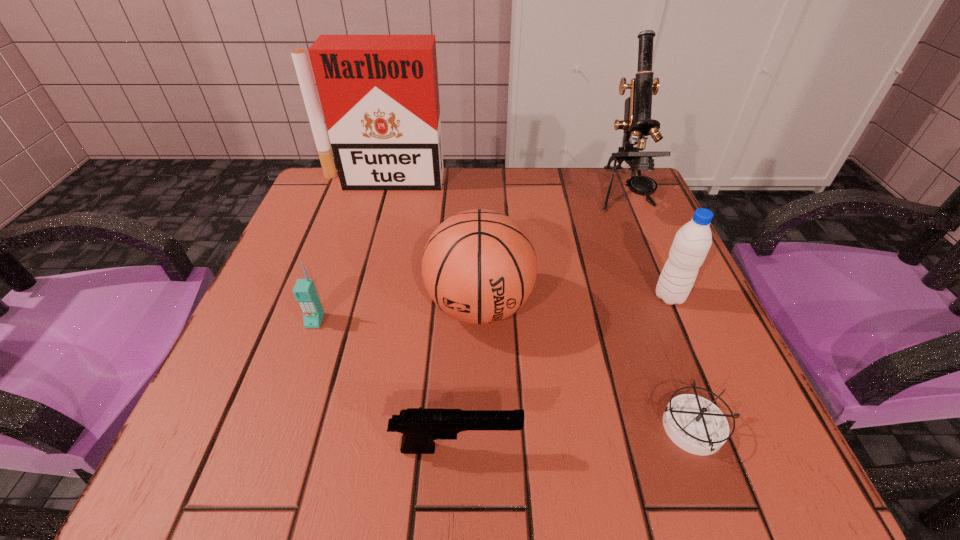
Find the location of a particular element. This screenshot has height=540, width=960. vacant space in between the shortest object and the second shortest object is located at coordinates (575, 438).

The width and height of the screenshot is (960, 540). I want to click on vacant region between the compass and the water bottle, so pyautogui.click(x=682, y=362).

Locate an element on the screen. The height and width of the screenshot is (540, 960). vacant point located between the water bottle and the microscope is located at coordinates (647, 246).

Find the location of a particular element. The image size is (960, 540). unoccupied area between the basketball and the shortest object is located at coordinates click(x=587, y=367).

The image size is (960, 540). Find the location of `vacant point located between the sixth tallest object and the basketball`. vacant point located between the sixth tallest object and the basketball is located at coordinates (468, 377).

Identify the location of free space between the compass and the sixth tallest object. The height and width of the screenshot is (540, 960). (575, 438).

Identify the location of vacant space that is in between the basketball and the compass. Image resolution: width=960 pixels, height=540 pixels. (587, 367).

Identify the location of free point between the cellular telephone and the basketball. (397, 313).

Locate an element on the screen. vacant point located between the shortest object and the cigarette case is located at coordinates (538, 304).

Where is `object that is the closest to the fifth tallest object`? Image resolution: width=960 pixels, height=540 pixels. object that is the closest to the fifth tallest object is located at coordinates (479, 266).